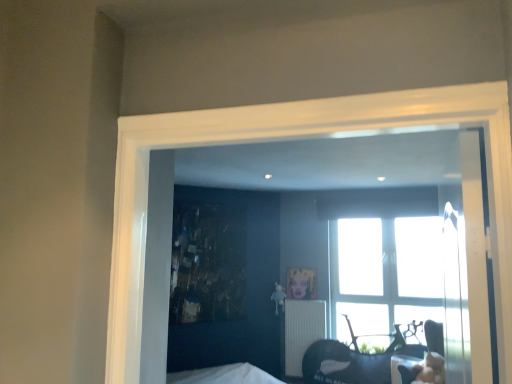
Question: Does white ribbed radiator at center turn towards metallic gold picture frame at center?

Choices:
 (A) no
 (B) yes

Answer: (A)

Question: Considering the relative sizes of white ribbed radiator at center and metallic gold picture frame at center in the image provided, is white ribbed radiator at center shorter than metallic gold picture frame at center?

Choices:
 (A) yes
 (B) no

Answer: (B)

Question: Is white ribbed radiator at center not inside metallic gold picture frame at center?

Choices:
 (A) no
 (B) yes

Answer: (B)

Question: Considering the relative positions of white ribbed radiator at center and metallic gold picture frame at center in the image provided, is white ribbed radiator at center to the right of metallic gold picture frame at center from the viewer's perspective?

Choices:
 (A) no
 (B) yes

Answer: (B)

Question: Is white ribbed radiator at center touching metallic gold picture frame at center?

Choices:
 (A) no
 (B) yes

Answer: (A)

Question: Considering the positions of white ribbed radiator at center and matte black chair at lower right in the image, is white ribbed radiator at center taller or shorter than matte black chair at lower right?

Choices:
 (A) short
 (B) tall

Answer: (B)

Question: From the image's perspective, relative to matte black chair at lower right, is white ribbed radiator at center above or below?

Choices:
 (A) above
 (B) below

Answer: (A)

Question: Considering the positions of white ribbed radiator at center and matte black chair at lower right in the image, is white ribbed radiator at center wider or thinner than matte black chair at lower right?

Choices:
 (A) wide
 (B) thin

Answer: (B)

Question: In the image, is white ribbed radiator at center on the left side or the right side of matte black chair at lower right?

Choices:
 (A) right
 (B) left

Answer: (B)

Question: Which is correct: metallic gold picture frame at center is inside white ribbed radiator at center, or outside of it?

Choices:
 (A) inside
 (B) outside

Answer: (B)

Question: Relative to white ribbed radiator at center, is metallic gold picture frame at center in front or behind?

Choices:
 (A) front
 (B) behind

Answer: (B)

Question: Considering the positions of metallic gold picture frame at center and white ribbed radiator at center in the image, is metallic gold picture frame at center taller or shorter than white ribbed radiator at center?

Choices:
 (A) short
 (B) tall

Answer: (A)

Question: From a real-world perspective, is metallic gold picture frame at center positioned above or below white ribbed radiator at center?

Choices:
 (A) above
 (B) below

Answer: (A)

Question: In terms of height, does matte black chair at lower right look taller or shorter compared to white ribbed radiator at center?

Choices:
 (A) tall
 (B) short

Answer: (B)

Question: Is matte black chair at lower right wider or thinner than white ribbed radiator at center?

Choices:
 (A) wide
 (B) thin

Answer: (A)